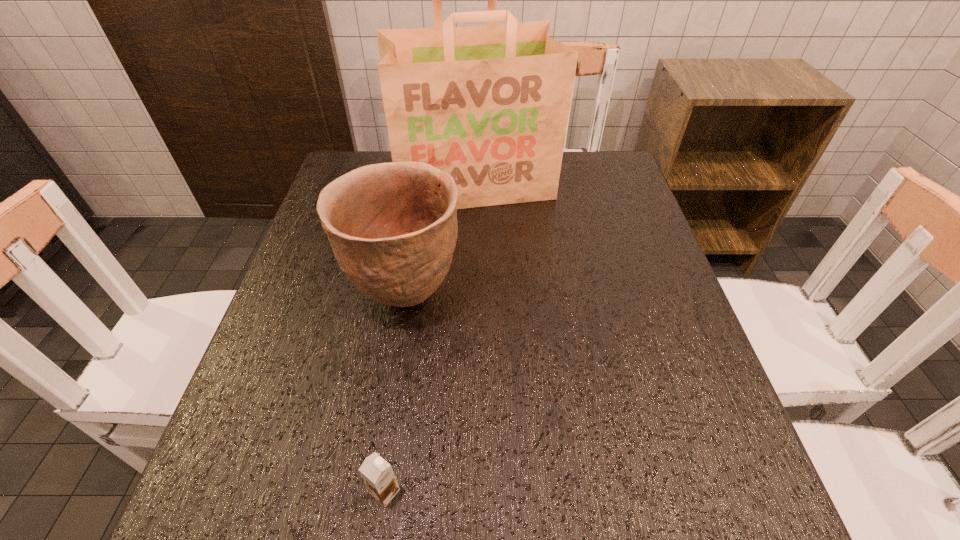
Find the location of a particular element. The image size is (960, 540). free space between the pottery and the shortest object is located at coordinates (396, 393).

The width and height of the screenshot is (960, 540). I want to click on vacant space that is in between the tallest object and the nearest object, so click(x=430, y=338).

Locate an element on the screen. Image resolution: width=960 pixels, height=540 pixels. vacant point located between the second tallest object and the shortest object is located at coordinates (396, 393).

The height and width of the screenshot is (540, 960). In order to click on unoccupied position between the second nearest object and the shortest object in this screenshot , I will do `click(396, 393)`.

At what (x,y) coordinates should I click in order to perform the action: click on free spot between the shortest object and the tallest object. Please return your answer as a coordinate pair (x, y). This screenshot has height=540, width=960. Looking at the image, I should click on (430, 338).

Select which object is the second closest to the second tallest object. Please provide its 2D coordinates. Your answer should be formatted as a tuple, i.e. [(x, y)], where the tuple contains the x and y coordinates of a point satisfying the conditions above.

[(378, 475)]

In order to click on object that is the closest to the pottery in this screenshot , I will do `click(489, 105)`.

Find the location of a particular element. free point that satisfies the following two spatial constraints: 1. on the front side of the shortest object; 2. on the right side of the pottery is located at coordinates (373, 492).

I want to click on free spot that satisfies the following two spatial constraints: 1. on the back side of the farthest object; 2. on the right side of the pottery, so click(422, 185).